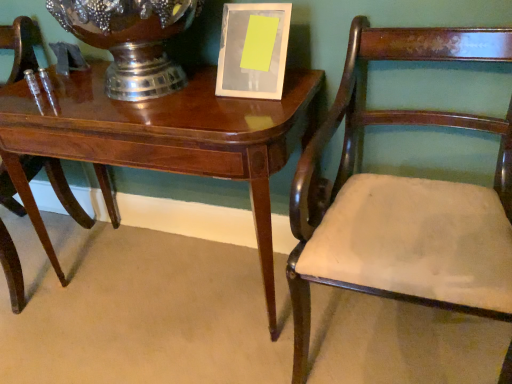
The width and height of the screenshot is (512, 384). What are the coordinates of `vacant space underneath brushed metal vase at upper center (from a real-world perspective)` in the screenshot? It's located at (x=148, y=99).